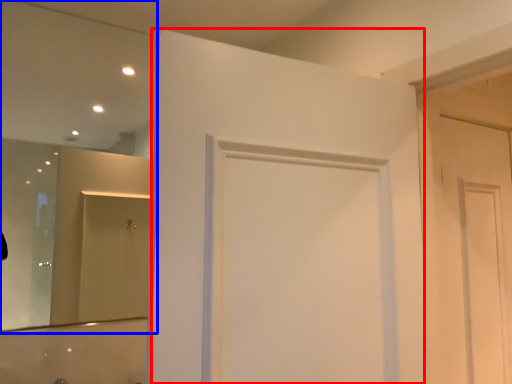
Question: Among these objects, which one is farthest to the camera, door (highlighted by a red box) or mirror (highlighted by a blue box)?

Choices:
 (A) door
 (B) mirror

Answer: (B)